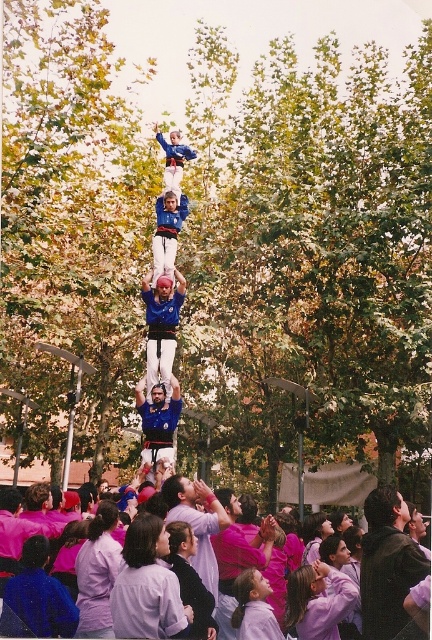
You are a photographer standing in front of the human tower. You want to take a photo that includes both the purple cotton shirt at center and the pink fabric crowd at lower center. Based on their positions, which object should you focus on first to ensure both are in frame?

The purple cotton shirt at center is positioned on the left side of pink fabric crowd at lower center, so you should focus on the pink fabric crowd at lower center first to ensure both are in frame.